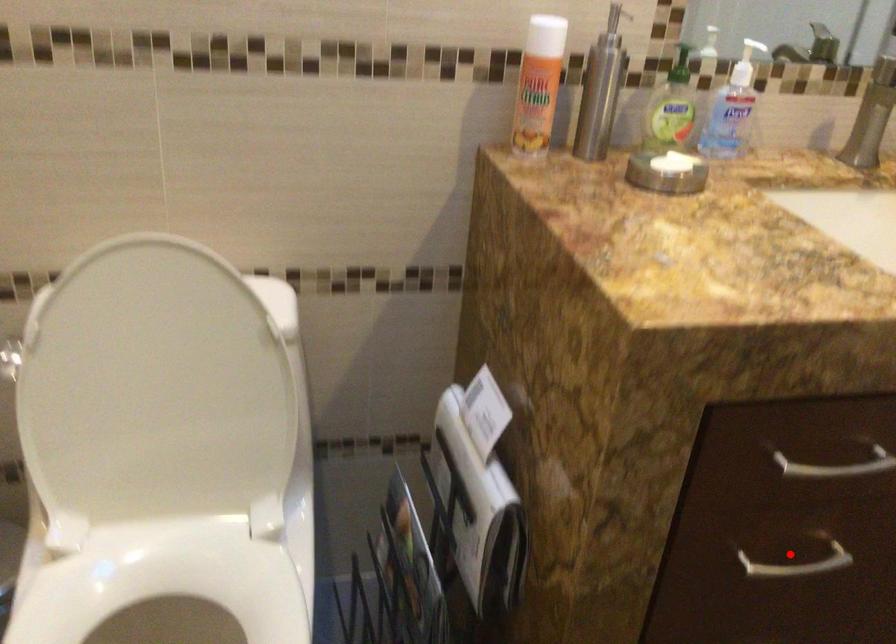
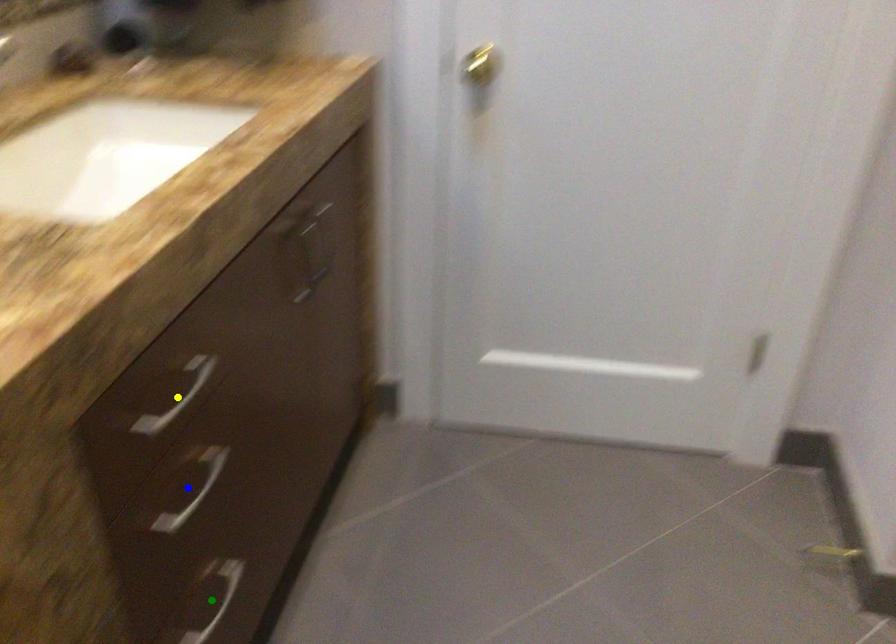
Question: I am providing you with two images of the same scene from different viewpoints. A red point is marked on the first image. You are given multiple points on the second image. In image 2, which mark is for the same physical point as the one in image 1?

Choices:
 (A) green point
 (B) blue point
 (C) yellow point

Answer: (B)